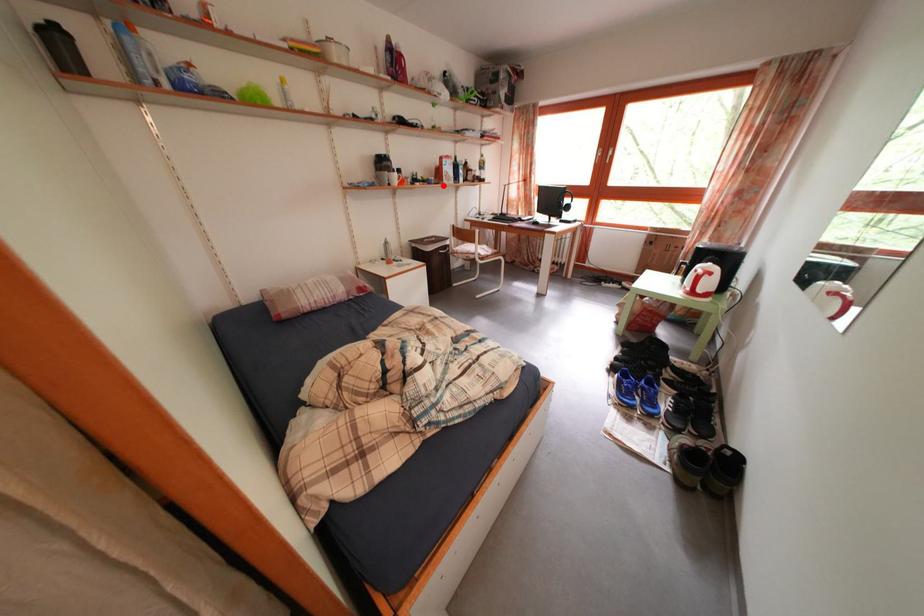
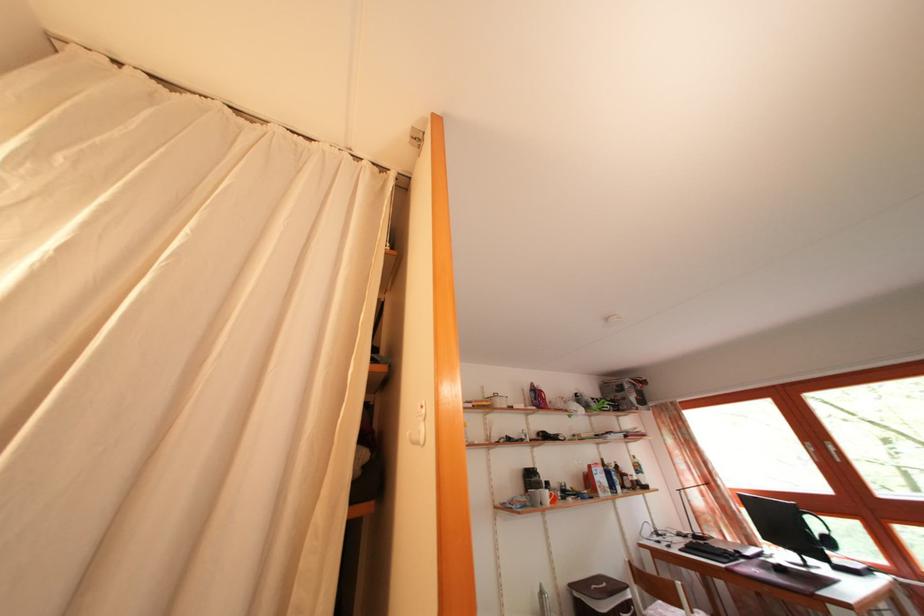
The point at the highlighted location is marked in the first image. Where is the corresponding point in the second image?

(593, 495)